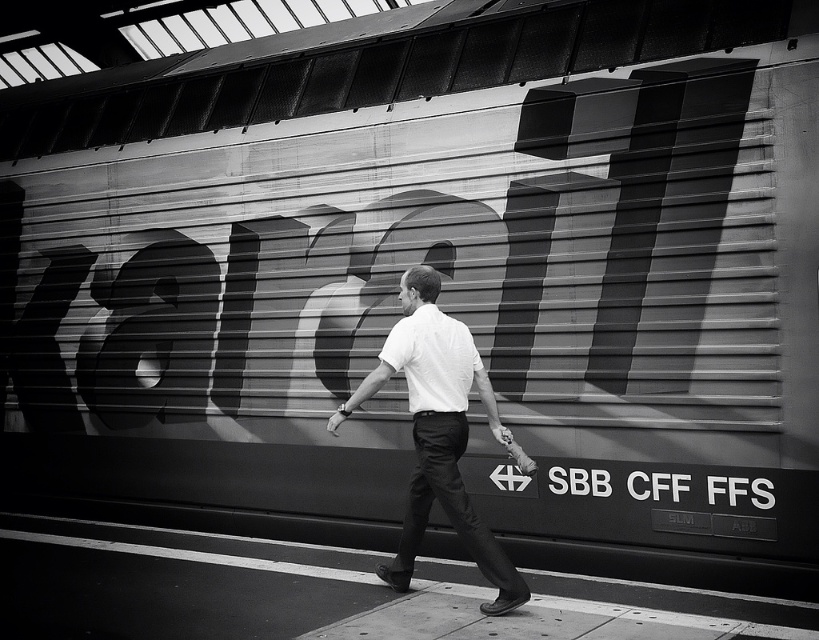
Is smooth concrete pavement at center taller than white smooth shirt at center?

No, smooth concrete pavement at center is not taller than white smooth shirt at center.

Which is more to the left, smooth concrete pavement at center or white smooth shirt at center?

smooth concrete pavement at center

Between point (698, 605) and point (400, 356), which one is positioned behind?

Point (400, 356)

Where is `smooth concrete pavement at center`? The width and height of the screenshot is (819, 640). smooth concrete pavement at center is located at coordinates (324, 595).